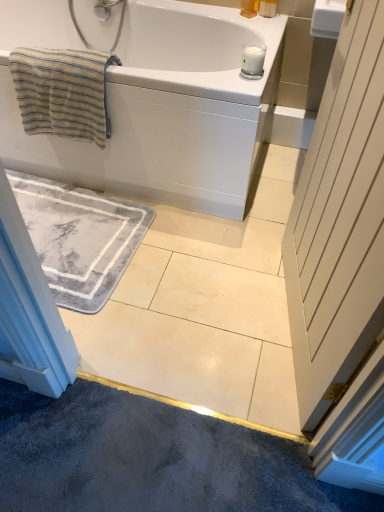
At what (x,y) coordinates should I click in order to perform the action: click on free space in front of white matte glass at upper center. Please return your answer as a coordinate pair (x, y). Looking at the image, I should click on (249, 82).